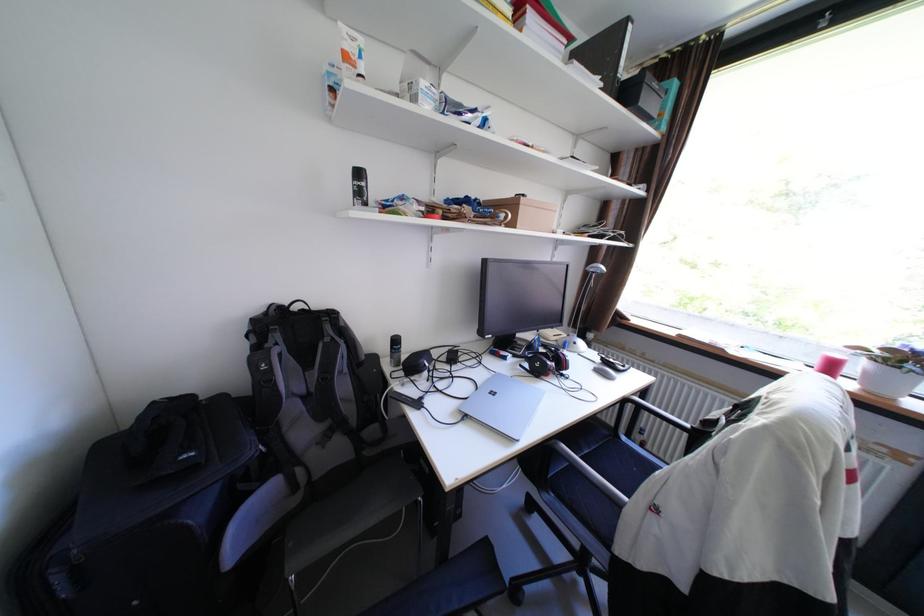
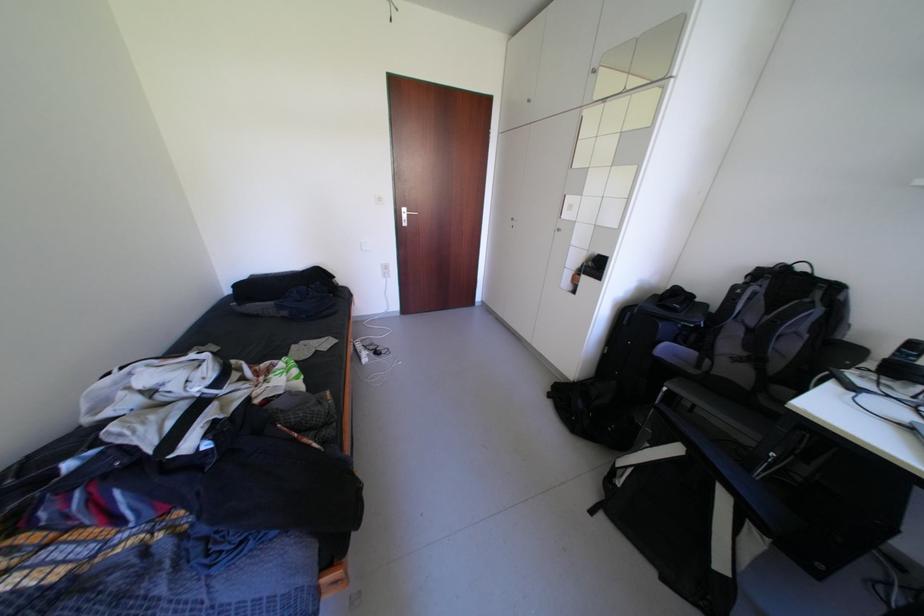
How did the camera likely rotate?

The camera's rotation is toward left-down.